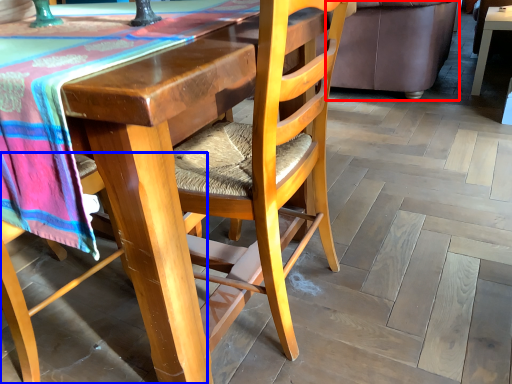
Question: Among these objects, which one is nearest to the camera, couch (highlighted by a red box) or chair (highlighted by a blue box)?

Choices:
 (A) couch
 (B) chair

Answer: (B)